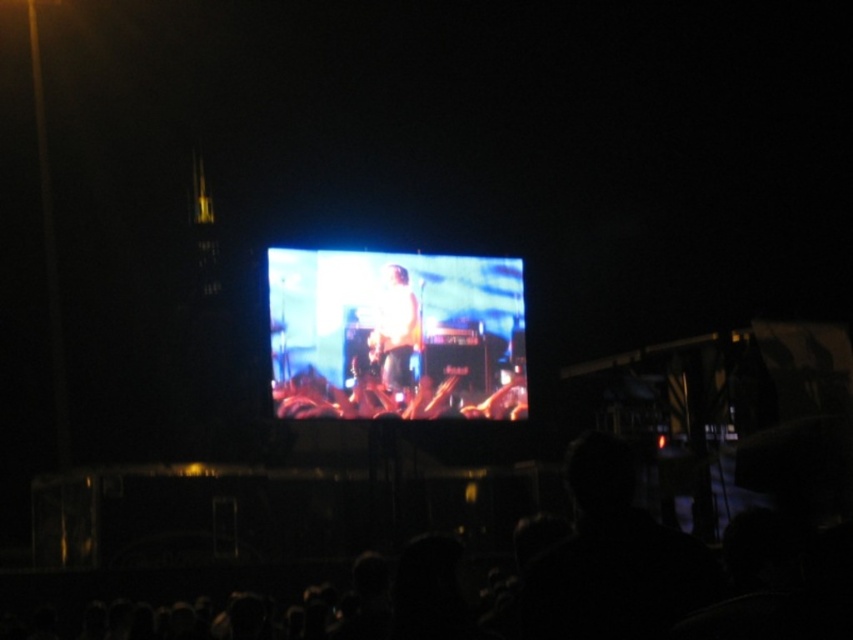
You are standing at the front row of the nighttime outdoor event. You want to take a photo of the black matte crowd at lower center. Considering the distance, will you need a zoom lens to capture them clearly?

The black matte crowd at lower center is 150.97 feet away from the viewer. To capture them clearly from that distance, you would need a zoom lens.